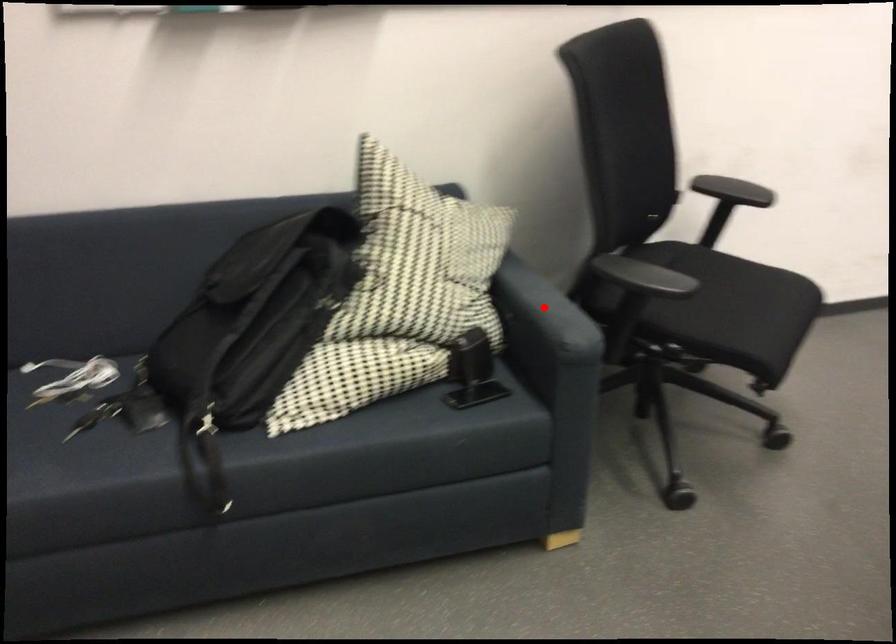
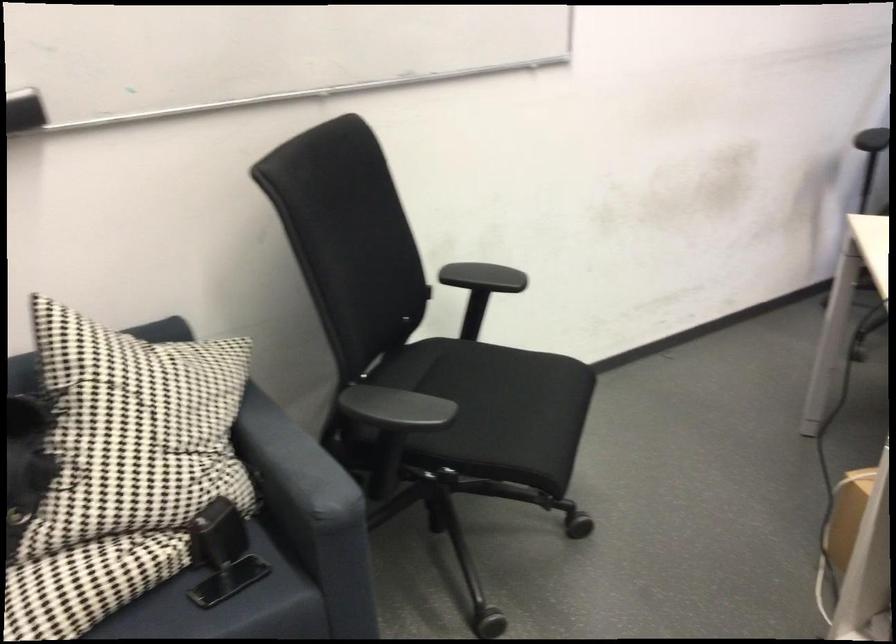
Question: I am providing you with two images of the same scene from different viewpoints. A red point is marked on the first image. Can you still see the location of the red point in image 2?

Choices:
 (A) Yes
 (B) No

Answer: (A)